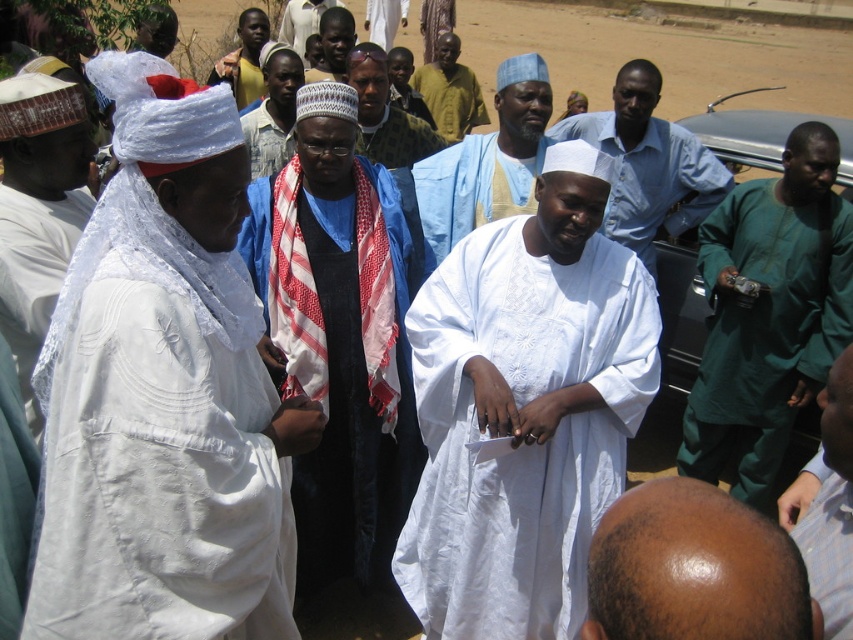
You are a photographer trying to capture a clear shot of both the white cotton shirt at center and the white cotton turban at center. Since you want to focus on the shirt first, which object should you adjust your camera to prioritize in terms of distance?

The white cotton shirt at center is closer to the viewer than the white cotton turban at center, so you should prioritize focusing on the white cotton shirt at center first as it is nearer.

You are standing at the point with coordinates point (x=648, y=164). What object are you currently standing on?

The point (x=648, y=164) is on white cotton shirt at center.

You are a photographer at this gathering and need to ensure all subjects are visible in the photo. Given the bald scalp at center and the green fabric shirt at lower right, which one might be more challenging to capture clearly due to its size?

The bald scalp at center is smaller than the green fabric shirt at lower right, so it might be more challenging to capture clearly due to its smaller size.